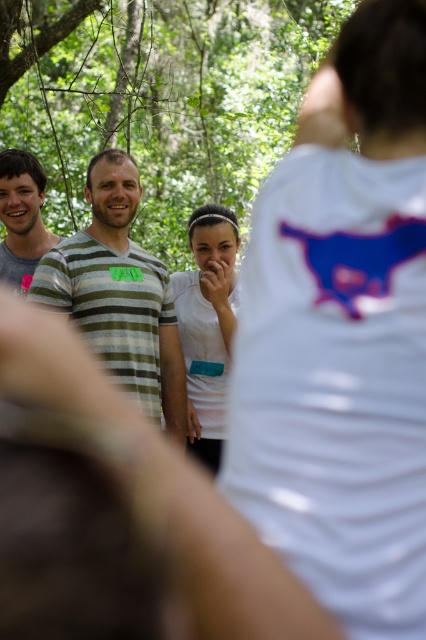
Which is more to the left, green leafy tree at upper center or striped cotton shirt at left?

Positioned to the left is green leafy tree at upper center.

Is green leafy tree at upper center taller than striped cotton shirt at left?

In fact, green leafy tree at upper center may be shorter than striped cotton shirt at left.

I want to click on green leafy tree at upper center, so click(x=161, y=99).

Locate an element on the screen. This screenshot has height=640, width=426. green leafy tree at upper center is located at coordinates (161, 99).

Is point (336, 77) farther from viewer compared to point (22, 220)?

That is False.

Between point (284, 305) and point (16, 230), which one is positioned in front?

Positioned in front is point (284, 305).

Where is `white matte shirt at center`? white matte shirt at center is located at coordinates (342, 336).

Based on the photo, is white matte shirt at center positioned before green leafy tree at upper center?

Yes.

Who is lower down, white matte shirt at center or green leafy tree at upper center?

white matte shirt at center is lower down.

Who is more distant from viewer, (x=232, y=385) or (x=236, y=64)?

Point (x=236, y=64)

Where is `white matte shirt at center`? The image size is (426, 640). white matte shirt at center is located at coordinates (342, 336).